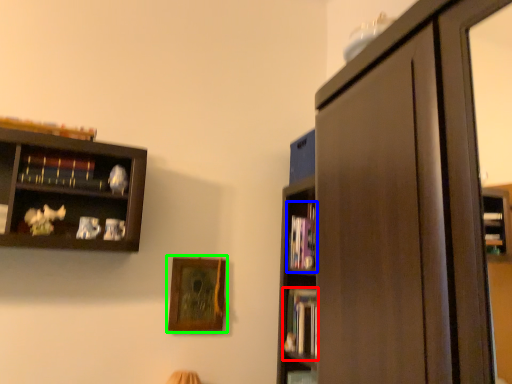
Question: Which object is positioned closest to book (highlighted by a red box)? Select from book (highlighted by a blue box) and picture frame (highlighted by a green box).

Choices:
 (A) book
 (B) picture frame

Answer: (A)